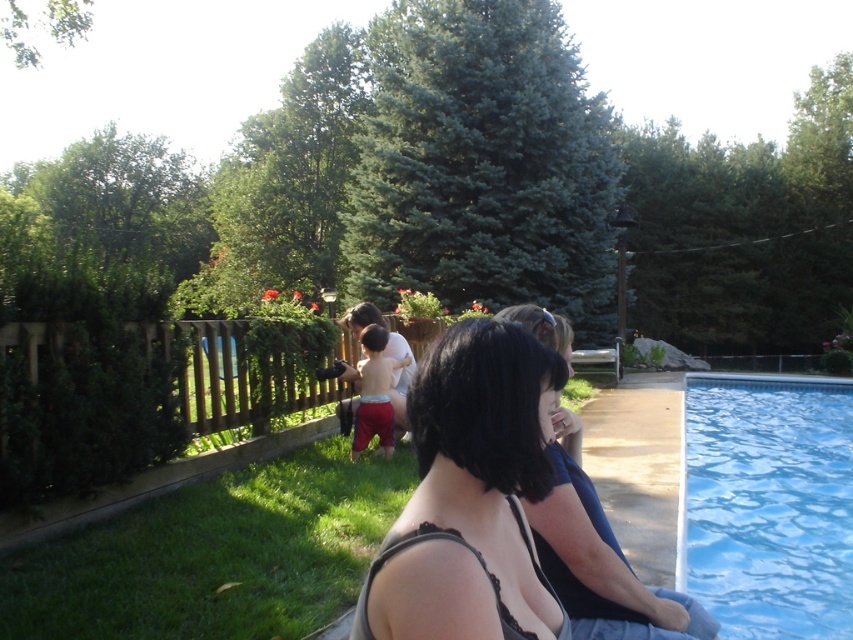
Question: Can you confirm if dark gray fabric top at lower right is positioned to the left of smooth skin girl at center?

Choices:
 (A) no
 (B) yes

Answer: (A)

Question: Which of these objects is positioned farthest from the dark gray fabric top at lower right?

Choices:
 (A) dark hair at center
 (B) blue smooth water at right
 (C) smooth skin girl at center

Answer: (B)

Question: Which object appears farthest from the camera in this image?

Choices:
 (A) smooth skin girl at center
 (B) blue smooth water at right
 (C) dark hair at center

Answer: (A)

Question: Is blue smooth water at right to the right of smooth skin girl at center from the viewer's perspective?

Choices:
 (A) yes
 (B) no

Answer: (A)

Question: Is blue smooth water at right positioned before dark gray fabric top at lower right?

Choices:
 (A) no
 (B) yes

Answer: (A)

Question: Which of the following is the closest to the observer?

Choices:
 (A) dark gray fabric top at lower right
 (B) smooth skin girl at center
 (C) dark hair at center
 (D) blue smooth water at right

Answer: (C)